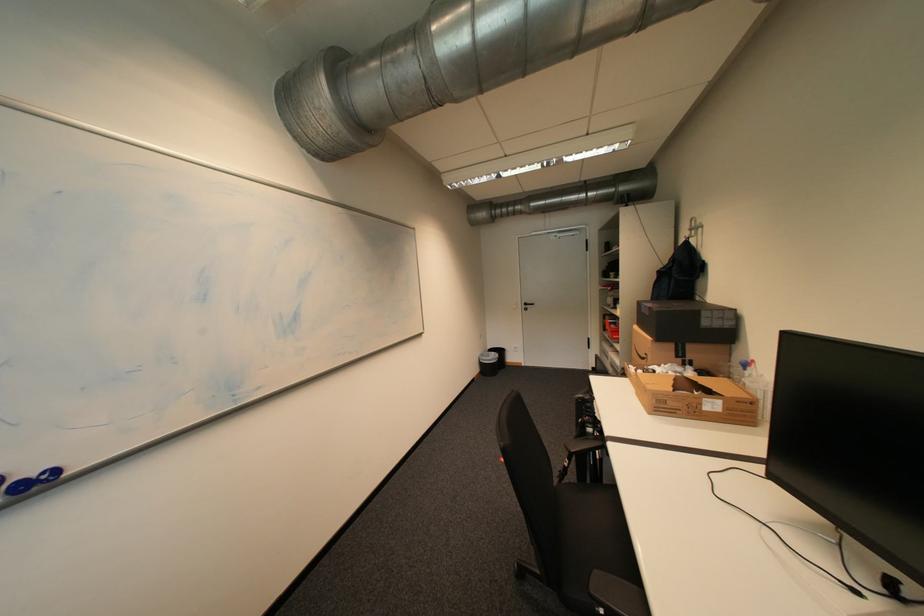
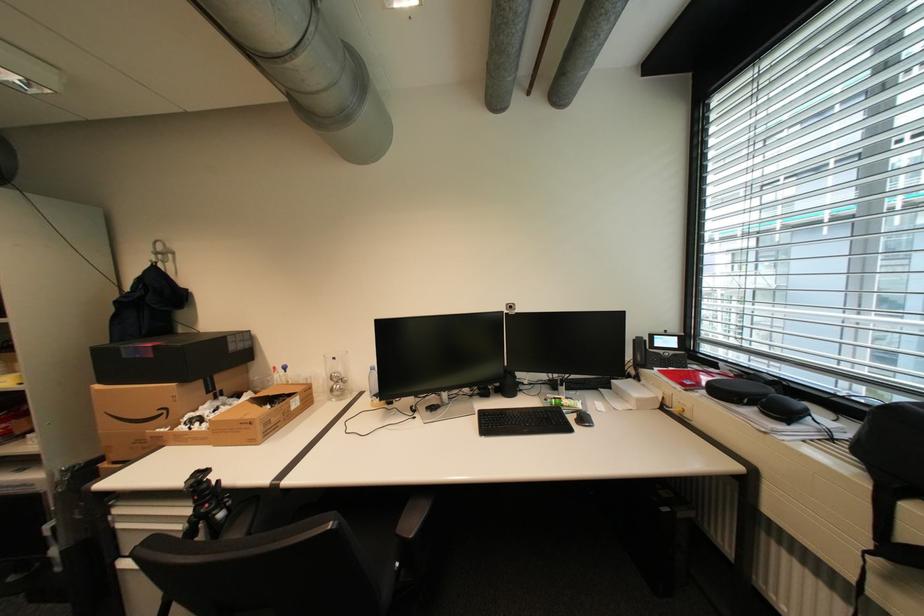
In the second image, find the point that corresponds to (657,315) in the first image.

(161, 357)